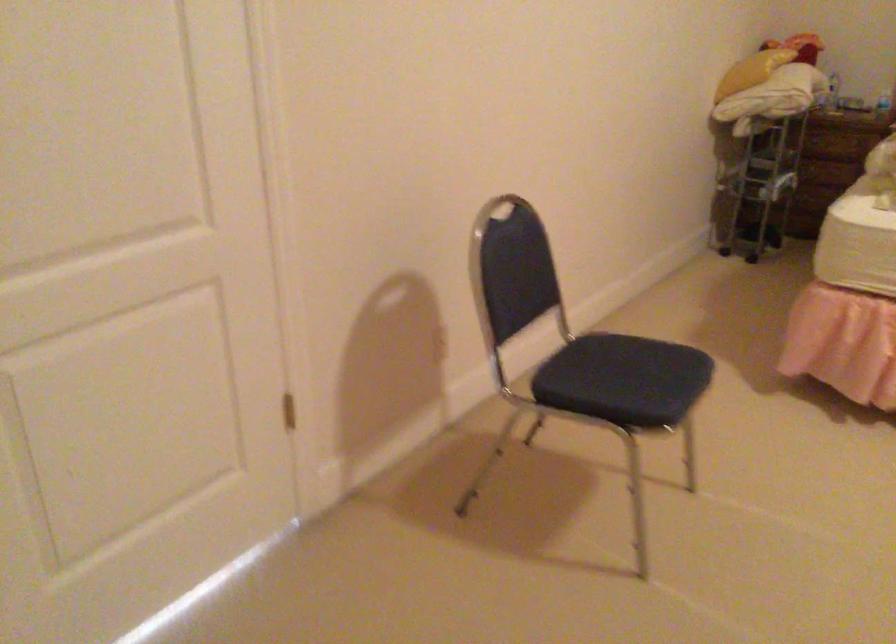
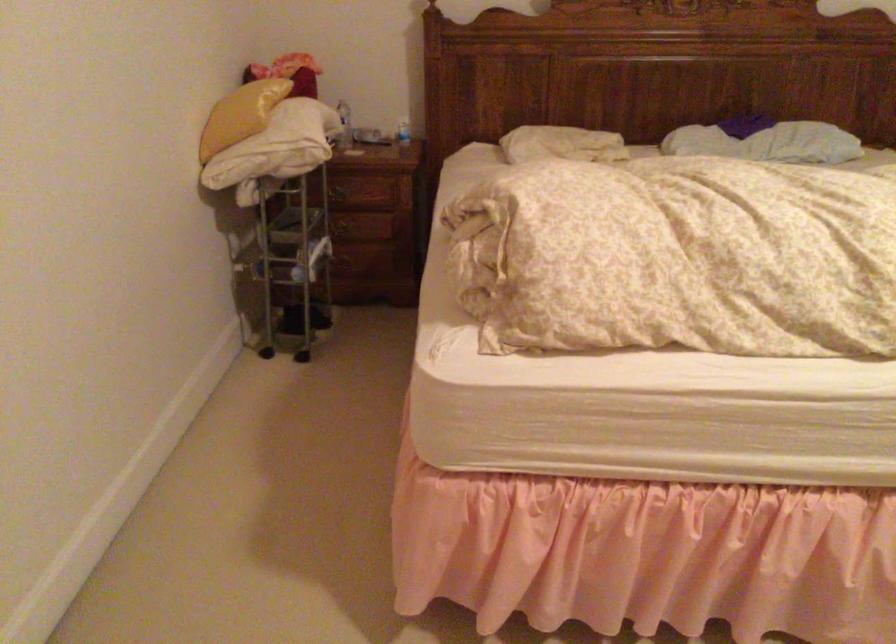
Find the pixel in the second image that matches point (788, 144) in the first image.

(342, 230)